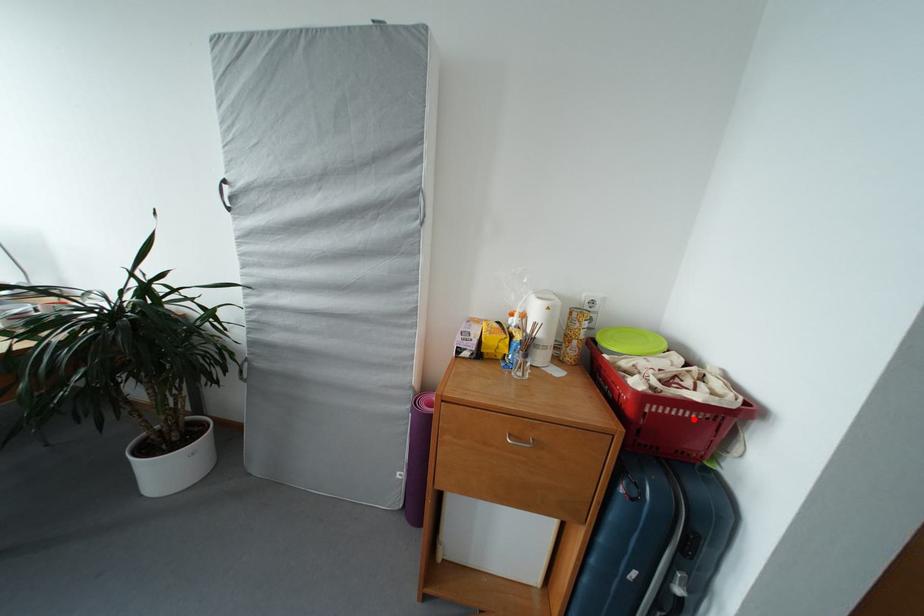
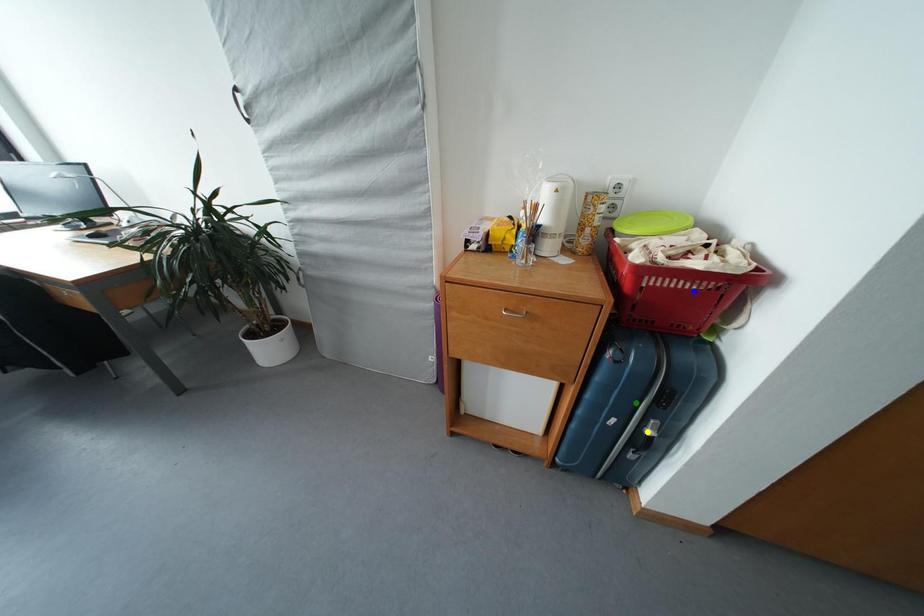
Question: I am providing you with two images of the same scene from different viewpoints. A red point is marked on the first image. You are given multiple points on the second image. Can you choose the point in image 2 that corresponds to the point in image 1?

Choices:
 (A) green point
 (B) yellow point
 (C) blue point

Answer: (C)